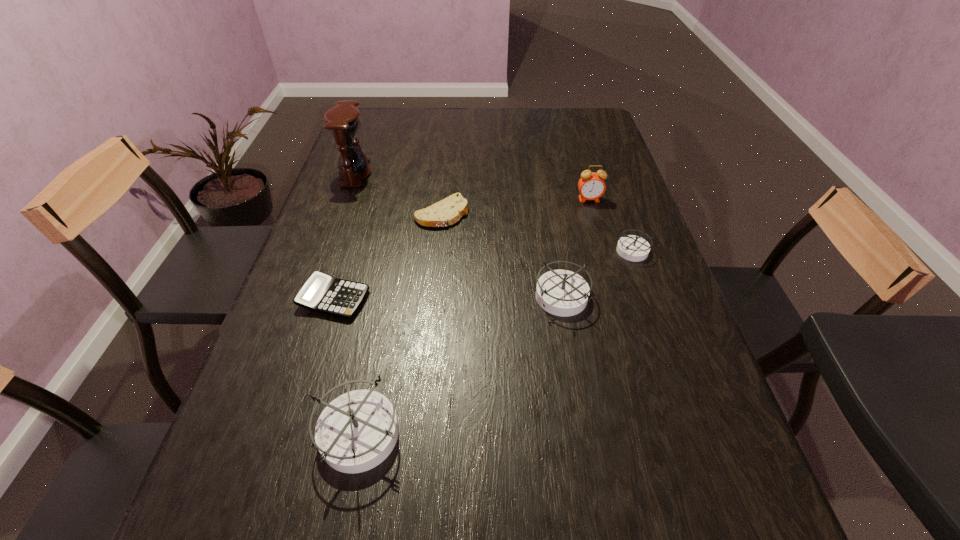
Locate an element on the screen. Image resolution: width=960 pixels, height=540 pixels. alarm clock is located at coordinates (591, 185).

Locate an element on the screen. This screenshot has height=540, width=960. vacant position located on the back of the leftmost compass is located at coordinates (392, 261).

Locate an element on the screen. free space located on the back of the third object from right to left is located at coordinates (552, 241).

Locate an element on the screen. free space located 0.100m on the left of the farthest compass is located at coordinates (577, 251).

This screenshot has width=960, height=540. Find the location of `vacant space located on the back of the shortest object`. vacant space located on the back of the shortest object is located at coordinates (445, 170).

Where is `vacant space located on the back of the calculator`? vacant space located on the back of the calculator is located at coordinates (354, 233).

Locate an element on the screen. Image resolution: width=960 pixels, height=540 pixels. blank space located 0.390m on the front of the hourglass is located at coordinates (317, 282).

Where is `vacant space located 0.350m on the face of the alarm clock`? vacant space located 0.350m on the face of the alarm clock is located at coordinates (615, 292).

The image size is (960, 540). In order to click on object that is at the near edge in this screenshot , I will do `click(357, 431)`.

What are the coordinates of `compass present at the left edge` in the screenshot? It's located at (357, 431).